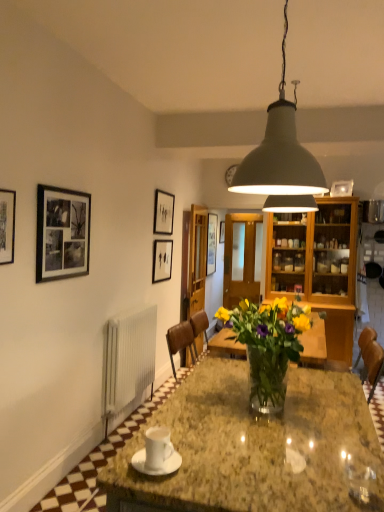
Question: Does matte black picture frame at upper center, arranged as the third picture frame when viewed from the left, have a greater width compared to black matte picture frame at upper left, which appears as the 4th picture frame when viewed from the back?

Choices:
 (A) no
 (B) yes

Answer: (A)

Question: Can you confirm if matte black picture frame at upper center, the 2th picture frame in the right-to-left sequence, is positioned to the right of black matte picture frame at upper left, arranged as the first picture frame when viewed from the left?

Choices:
 (A) no
 (B) yes

Answer: (B)

Question: From a real-world perspective, is matte black picture frame at upper center, positioned as the third picture frame in back-to-front order, on black matte picture frame at upper left, positioned as the fourth picture frame in right-to-left order?

Choices:
 (A) no
 (B) yes

Answer: (B)

Question: Can you confirm if matte black picture frame at upper center, arranged as the 2th picture frame when viewed from the front, is positioned to the left of black matte picture frame at upper left, positioned as the fourth picture frame in right-to-left order?

Choices:
 (A) no
 (B) yes

Answer: (A)

Question: Considering the relative sizes of matte black picture frame at upper center, arranged as the 2th picture frame when viewed from the front, and black matte picture frame at upper left, positioned as the fourth picture frame in right-to-left order, in the image provided, is matte black picture frame at upper center, arranged as the 2th picture frame when viewed from the front, thinner than black matte picture frame at upper left, positioned as the fourth picture frame in right-to-left order,?

Choices:
 (A) no
 (B) yes

Answer: (B)

Question: Considering the positions of matte black picture frame at upper center, the 2th picture frame in the right-to-left sequence, and matte black picture frame at center, positioned as the third picture frame in right-to-left order, in the image, is matte black picture frame at upper center, the 2th picture frame in the right-to-left sequence, taller or shorter than matte black picture frame at center, positioned as the third picture frame in right-to-left order,?

Choices:
 (A) tall
 (B) short

Answer: (B)

Question: Considering the positions of point (152, 230) and point (157, 247), is point (152, 230) closer or farther from the camera than point (157, 247)?

Choices:
 (A) closer
 (B) farther

Answer: (A)

Question: Looking at their shapes, would you say matte black picture frame at upper center, arranged as the 2th picture frame when viewed from the front, is wider or thinner than matte black picture frame at center, the 2th picture frame from the left?

Choices:
 (A) wide
 (B) thin

Answer: (A)

Question: From the image's perspective, relative to matte black picture frame at center, positioned as the second picture frame in back-to-front order, is matte black picture frame at upper center, positioned as the third picture frame in back-to-front order, above or below?

Choices:
 (A) below
 (B) above

Answer: (B)

Question: Would you say matte gray lampshade at upper center is to the left or to the right of matte black picture frame at upper center, positioned as the third picture frame in back-to-front order, in the picture?

Choices:
 (A) right
 (B) left

Answer: (A)

Question: Considering the positions of matte gray lampshade at upper center and matte black picture frame at upper center, the 2th picture frame in the right-to-left sequence, in the image, is matte gray lampshade at upper center bigger or smaller than matte black picture frame at upper center, the 2th picture frame in the right-to-left sequence,?

Choices:
 (A) big
 (B) small

Answer: (A)

Question: From the image's perspective, relative to matte black picture frame at upper center, arranged as the 2th picture frame when viewed from the front, is matte gray lampshade at upper center above or below?

Choices:
 (A) below
 (B) above

Answer: (B)

Question: From a real-world perspective, is matte gray lampshade at upper center above or below matte black picture frame at upper center, arranged as the third picture frame when viewed from the left?

Choices:
 (A) below
 (B) above

Answer: (B)

Question: Considering the positions of white glossy saucer at center and yellow matte vase at center in the image, is white glossy saucer at center wider or thinner than yellow matte vase at center?

Choices:
 (A) wide
 (B) thin

Answer: (A)

Question: From a real-world perspective, is white glossy saucer at center above or below yellow matte vase at center?

Choices:
 (A) below
 (B) above

Answer: (A)